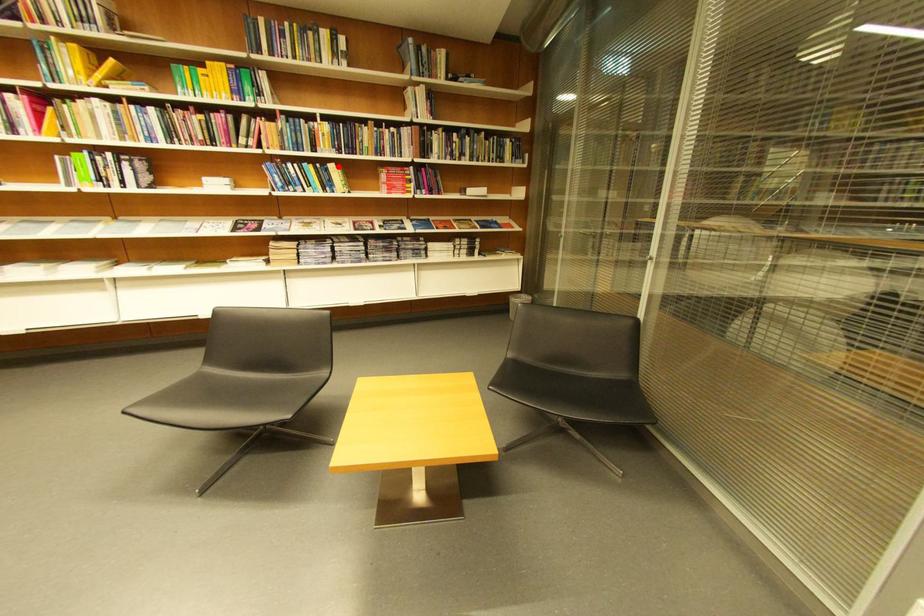
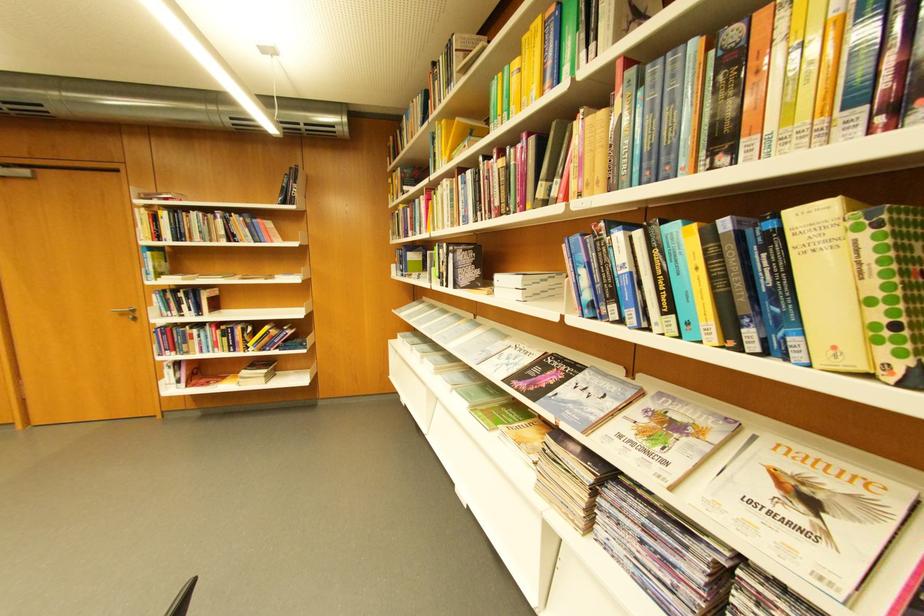
Question: I am providing you with two images of the same scene from different viewpoints. In image1, a red point is highlighted. Considering the same 3D point in image2, which of the following is correct?

Choices:
 (A) It is closer
 (B) It is farther

Answer: (B)